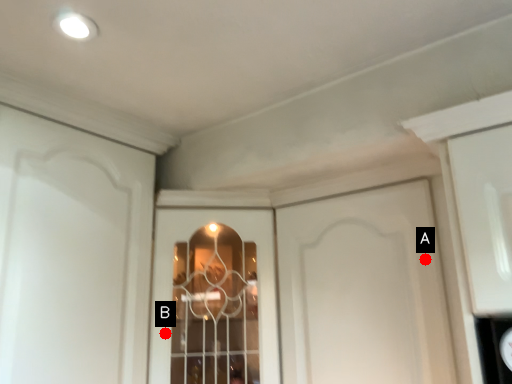
Question: Two points are circled on the image, labeled by A and B beside each circle. Which point is closer to the camera taking this photo?

Choices:
 (A) A is closer
 (B) B is closer

Answer: (A)